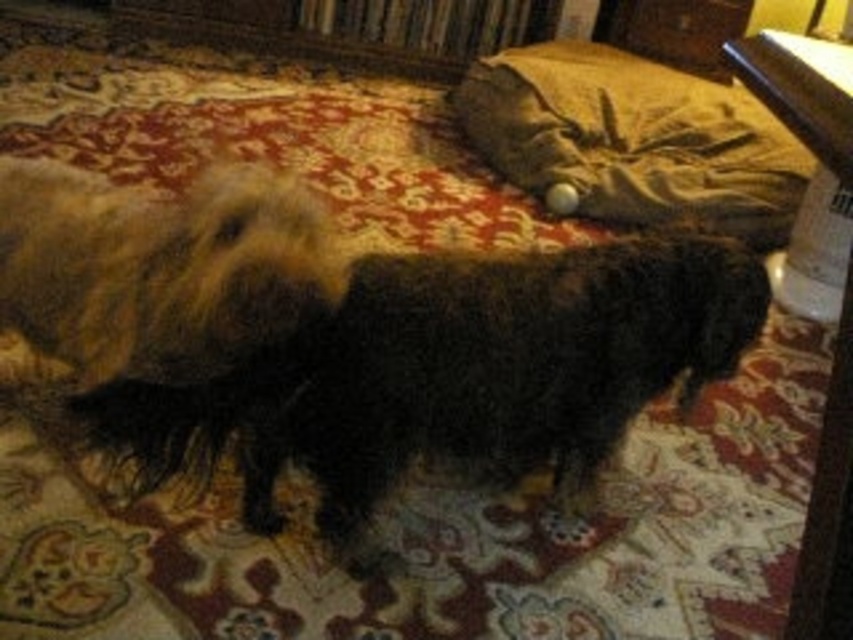
Is fuzzy brown fur at center wider than velvet-like brown dog bed at upper right?

No, fuzzy brown fur at center is not wider than velvet-like brown dog bed at upper right.

Does point (100, 336) come behind point (572, 65)?

No, (100, 336) is in front of (572, 65).

Does point (180, 259) come farther from viewer compared to point (517, 51)?

No, (180, 259) is in front of (517, 51).

Identify the location of fuzzy brown fur at center. This screenshot has width=853, height=640. (161, 268).

Can you confirm if fuzzy black dog at center is thinner than fuzzy brown fur at center?

No, fuzzy black dog at center is not thinner than fuzzy brown fur at center.

Does fuzzy black dog at center appear over fuzzy brown fur at center?

Incorrect, fuzzy black dog at center is not positioned above fuzzy brown fur at center.

This screenshot has width=853, height=640. What do you see at coordinates (456, 372) in the screenshot?
I see `fuzzy black dog at center` at bounding box center [456, 372].

Locate an element on the screen. fuzzy black dog at center is located at coordinates (456, 372).

Which is below, fuzzy black dog at center or velvet-like brown dog bed at upper right?

fuzzy black dog at center is below.

The image size is (853, 640). I want to click on fuzzy black dog at center, so click(456, 372).

Who is more forward, (173, 474) or (682, 93)?

Point (173, 474)

The height and width of the screenshot is (640, 853). In order to click on fuzzy black dog at center in this screenshot , I will do coord(456,372).